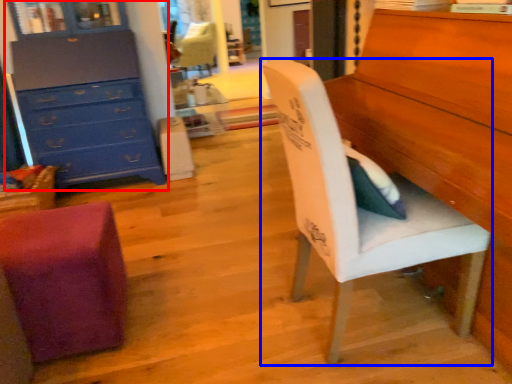
Question: Which of the following is the closest to the observer, chest of drawers (highlighted by a red box) or chair (highlighted by a blue box)?

Choices:
 (A) chest of drawers
 (B) chair

Answer: (B)